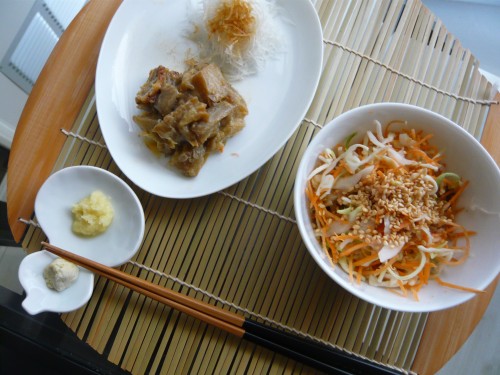
Find the location of a particular element. This screenshot has height=375, width=500. wood planks is located at coordinates (455, 323), (38, 155).